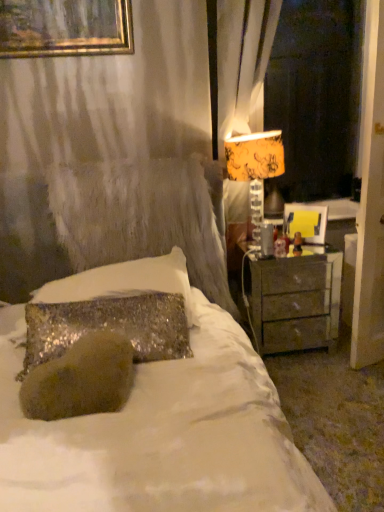
What do you see at coordinates (292, 300) in the screenshot? I see `matte gray nightstand at right` at bounding box center [292, 300].

Identify the location of yellow fabric lampshade at upper right. Image resolution: width=384 pixels, height=512 pixels. (255, 156).

From the image's perspective, is matte yellow lampshade at right on matte gray nightstand at right?

Indeed, from the image's perspective, matte yellow lampshade at right is shown above matte gray nightstand at right.

From a real-world perspective, which object stands above the other?

matte yellow lampshade at right is physically above.

Is matte yellow lampshade at right beside matte gray nightstand at right?

No, matte yellow lampshade at right is not touching matte gray nightstand at right.

Would you say matte yellow lampshade at right is to the left or to the right of matte gray nightstand at right in the picture?

In the image, matte yellow lampshade at right appears on the right side of matte gray nightstand at right.

In order to click on pillow on the left of matte gray nightstand at right in this screenshot , I will do `click(126, 282)`.

Considering the sizes of objects matte gray nightstand at right and sparkly silver pillow at center in the image provided, who is thinner, matte gray nightstand at right or sparkly silver pillow at center?

matte gray nightstand at right.

Can you confirm if matte gray nightstand at right is positioned to the right of sparkly silver pillow at center?

Correct, you'll find matte gray nightstand at right to the right of sparkly silver pillow at center.

Is point (278, 348) closer or farther from the camera than point (188, 302)?

Point (278, 348) is positioned farther from the camera compared to point (188, 302).

How different are the orientations of yellow fabric lampshade at upper right and matte gray nightstand at right in degrees?

The angular difference between yellow fabric lampshade at upper right and matte gray nightstand at right is 0.604 degrees.

Considering the sizes of objects yellow fabric lampshade at upper right and matte gray nightstand at right in the image provided, who is thinner, yellow fabric lampshade at upper right or matte gray nightstand at right?

yellow fabric lampshade at upper right.

Based on the photo, from the image's perspective, is yellow fabric lampshade at upper right below matte gray nightstand at right?

No, from the image's perspective, yellow fabric lampshade at upper right is not below matte gray nightstand at right.

In the image, is yellow fabric lampshade at upper right positioned in front of or behind matte gray nightstand at right?

yellow fabric lampshade at upper right is in front of matte gray nightstand at right.

Based on their positions, is matte gray nightstand at right located to the left or right of yellow fabric lampshade at upper right?

From the image, it's evident that matte gray nightstand at right is to the right of yellow fabric lampshade at upper right.

You are a GUI agent. You are given a task and a screenshot of the screen. Output one action in this format:
    pyautogui.click(x=<x>, y=<y>)
    Task: Click on the nightstand behind the yellow fabric lampshade at upper right
    This screenshot has width=384, height=512.
    Given the screenshot: What is the action you would take?
    pyautogui.click(x=292, y=300)

Is matte gray nightstand at right looking in the opposite direction of yellow fabric lampshade at upper right?

No, yellow fabric lampshade at upper right is not at the back of matte gray nightstand at right.

Which object is further away from the camera taking this photo, matte gray nightstand at right or yellow fabric lampshade at upper right?

matte gray nightstand at right.

Can you confirm if yellow fabric lampshade at upper right is shorter than matte yellow lampshade at right?

Indeed, yellow fabric lampshade at upper right has a lesser height compared to matte yellow lampshade at right.

From a real-world perspective, relative to matte yellow lampshade at right, is yellow fabric lampshade at upper right vertically above or below?

Clearly, from a real-world perspective, yellow fabric lampshade at upper right is below matte yellow lampshade at right.

How many degrees apart are the facing directions of yellow fabric lampshade at upper right and matte yellow lampshade at right?

The angle between the facing direction of yellow fabric lampshade at upper right and the facing direction of matte yellow lampshade at right is 0.604 degrees.

Is yellow fabric lampshade at upper right oriented towards matte yellow lampshade at right?

No, yellow fabric lampshade at upper right is not facing towards matte yellow lampshade at right.

Is matte gray nightstand at right inside the boundaries of matte yellow lampshade at right, or outside?

matte gray nightstand at right is located beyond the bounds of matte yellow lampshade at right.

From the image's perspective, is matte gray nightstand at right located above matte yellow lampshade at right?

No.

Between matte gray nightstand at right and matte yellow lampshade at right, which one has smaller width?

Thinner between the two is matte yellow lampshade at right.

Which is correct: sparkly silver pillow at center is inside matte gray nightstand at right, or outside of it?

sparkly silver pillow at center lies outside matte gray nightstand at right.

Is matte gray nightstand at right at the back of sparkly silver pillow at center?

No, sparkly silver pillow at center is not facing the opposite direction of matte gray nightstand at right.

Which of these two, sparkly silver pillow at center or matte gray nightstand at right, is wider?

Wider between the two is sparkly silver pillow at center.

Which object is positioned more to the right, sparkly silver pillow at center or matte gray nightstand at right?

matte gray nightstand at right.

Locate an element on the screen. window screen lying above the matte gray nightstand at right (from the image's perspective) is located at coordinates (316, 96).

The height and width of the screenshot is (512, 384). Identify the location of nightstand behind the sparkly silver pillow at center. (292, 300).

Estimate the real-world distances between objects in this image. Which object is further from matte gray nightstand at right, matte yellow lampshade at right or sparkly silver pillow at center?

Among the two, matte yellow lampshade at right is located further to matte gray nightstand at right.

From the image, which object appears to be nearer to matte yellow lampshade at right, matte gray nightstand at right or yellow fabric lampshade at upper right?

Among the two, matte gray nightstand at right is located nearer to matte yellow lampshade at right.

From the image, which object appears to be farther from sparkly silver pillow at center, yellow fabric lampshade at upper right or matte yellow lampshade at right?

Based on the image, matte yellow lampshade at right appears to be further to sparkly silver pillow at center.

When comparing their distances from matte gray nightstand at right, does sparkly silver pillow at center or yellow fabric lampshade at upper right seem further?

sparkly silver pillow at center lies further to matte gray nightstand at right than the other object.

Estimate the real-world distances between objects in this image. Which object is further from yellow fabric lampshade at upper right, sparkly silver pillow at center or matte gray nightstand at right?

Among the two, matte gray nightstand at right is located further to yellow fabric lampshade at upper right.

Which object lies nearer to the anchor point yellow fabric lampshade at upper right, sparkly silver pillow at center or matte yellow lampshade at right?

sparkly silver pillow at center.

Based on their spatial positions, is sparkly silver pillow at center or yellow fabric lampshade at upper right further from matte yellow lampshade at right?

sparkly silver pillow at center is further to matte yellow lampshade at right.

Considering their positions, is matte yellow lampshade at right positioned closer to sparkly silver pillow at center than matte gray nightstand at right?

matte gray nightstand at right is positioned closer to the anchor sparkly silver pillow at center.

Locate an element on the screen. This screenshot has height=512, width=384. table lamp located between sparkly silver pillow at center and matte yellow lampshade at right in the left-right direction is located at coordinates (255, 156).

Image resolution: width=384 pixels, height=512 pixels. In order to click on pillow between matte yellow lampshade at right and matte gray nightstand at right vertically in this screenshot , I will do [126, 282].

The width and height of the screenshot is (384, 512). In order to click on table lamp located between sparkly silver pillow at center and matte gray nightstand at right in the left-right direction in this screenshot , I will do tap(255, 156).

Where is `table lamp between matte yellow lampshade at right and matte gray nightstand at right from top to bottom`? table lamp between matte yellow lampshade at right and matte gray nightstand at right from top to bottom is located at coordinates (255, 156).